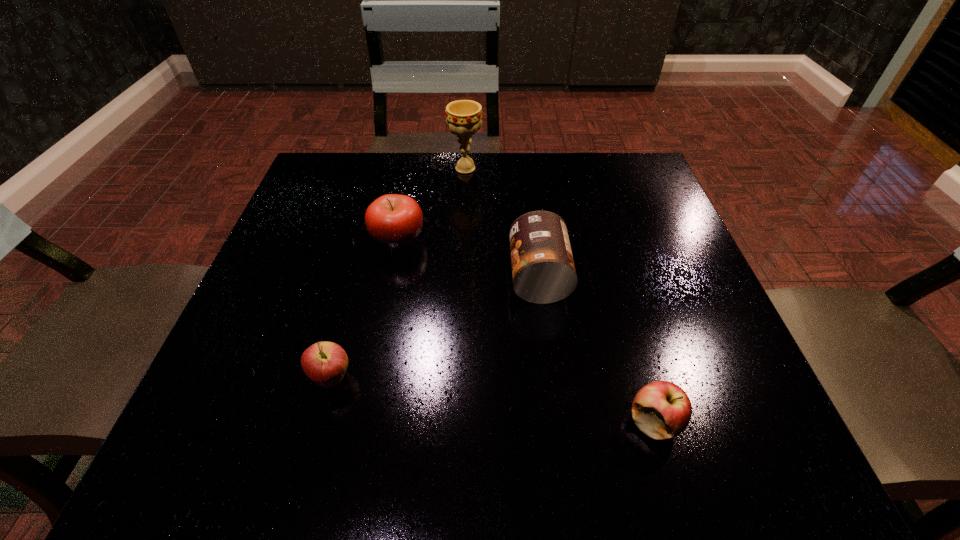
Locate an element on the screen. This screenshot has height=540, width=960. free location that satisfies the following two spatial constraints: 1. on the back side of the farthest apple; 2. on the right side of the tallest object is located at coordinates (412, 168).